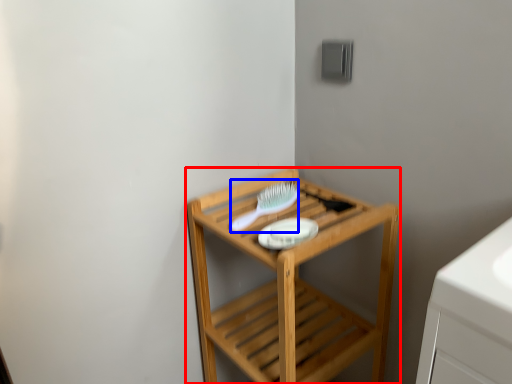
Question: Among these objects, which one is nearest to the camera, furniture (highlighted by a red box) or brush (highlighted by a blue box)?

Choices:
 (A) furniture
 (B) brush

Answer: (A)